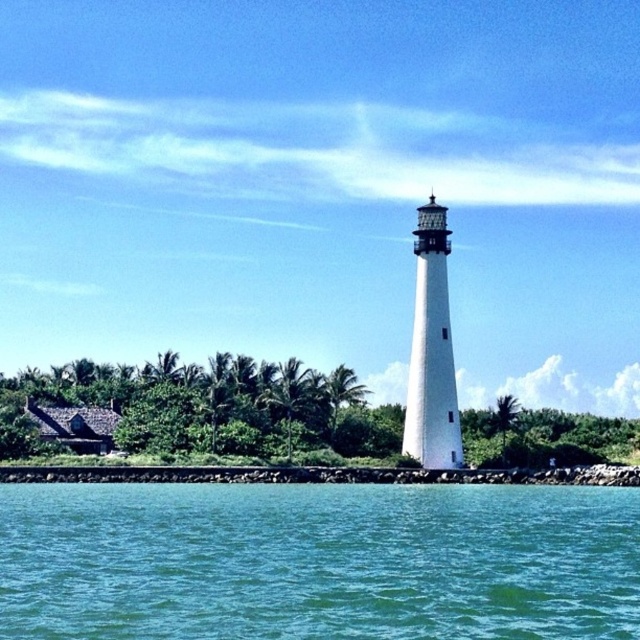
You are a seagull flying over the coastal area shown in the image. You want to land on the white textured lighthouse at center from the clear blue water at lower center. What is the approximate distance you need to cover?

The clear blue water at lower center and white textured lighthouse at center are 99.98 feet apart, so the seagull needs to cover approximately 100 feet to land on the white textured lighthouse at center from the clear blue water at lower center.

You are standing at the edge of the clear blue water at lower center and want to reach the white textured lighthouse at center. Which direction should you move to get closer to the lighthouse?

You should move upward because the clear blue water at lower center is below the white textured lighthouse at center.